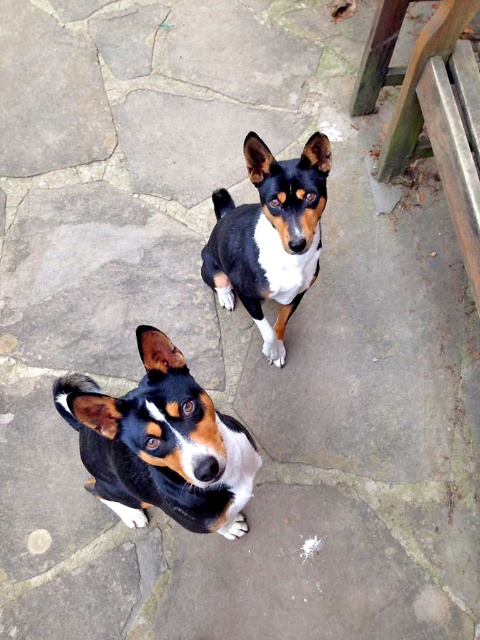
You are a photographer trying to capture both dogs in a single frame. Given that your camera can only focus on objects within a 1.2 meter width, will both the smooth black and white dog at center and the black and white fur dog at center fit within the frame?

The smooth black and white dog at center is larger in width than the black and white fur dog at center. Since the camera can only focus on objects within a 1.2 meter width, if the combined width of both dogs exceeds 1.2 meters, they won

You are a photographer trying to capture a closeup of the smooth black and white dog at center. You are currently positioned at point (162, 444). Which direction should you move to get closer to the dog?

The point (162, 444) is already where the smooth black and white dog at center is located, so you are already at the correct position to capture the closeup.

You are standing at the camera position and see two points marked in the image. Which point is closer to you, point (158, 499) or point (226, 253)?

Point (158, 499) is in front of point (226, 253), so it is closer to you.